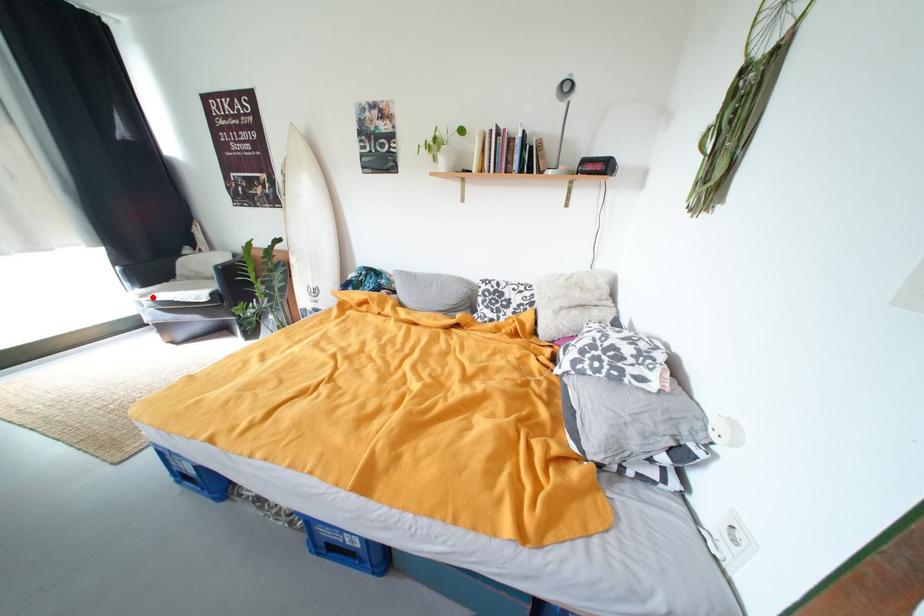
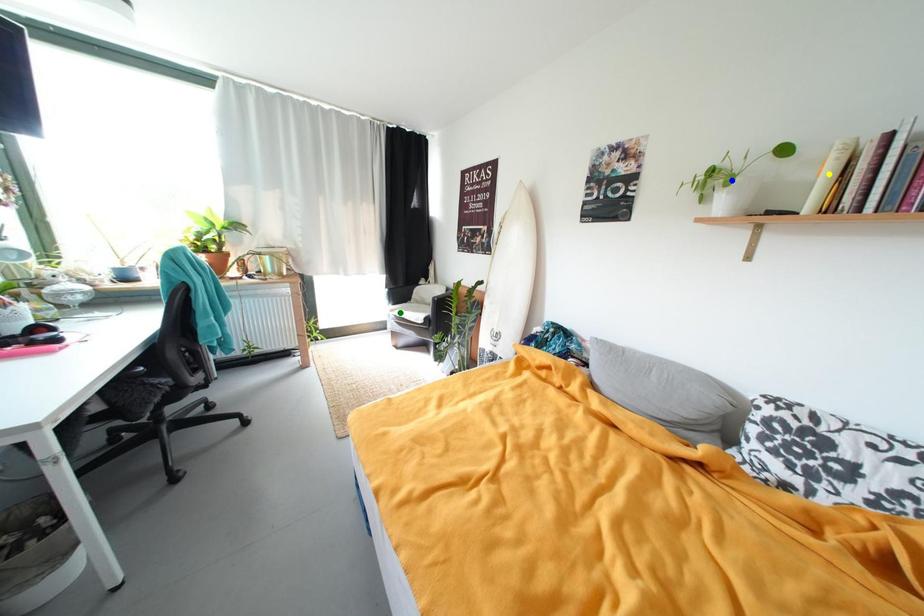
Question: I am providing you with two images of the same scene from different viewpoints. A red point is marked on the first image. You are given multiple points on the second image. In image 2, which mark is for the same physical point as the one in image 1?

Choices:
 (A) blue point
 (B) green point
 (C) yellow point

Answer: (B)